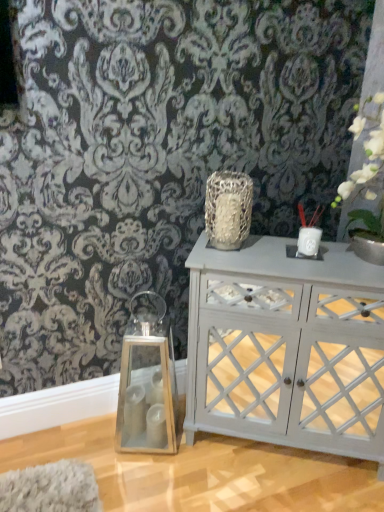
I want to click on free space that is in between textured silver vase at center and white ceramic candle holder at upper right, which ranks as the second candle holder in top-to-bottom order, so click(x=267, y=251).